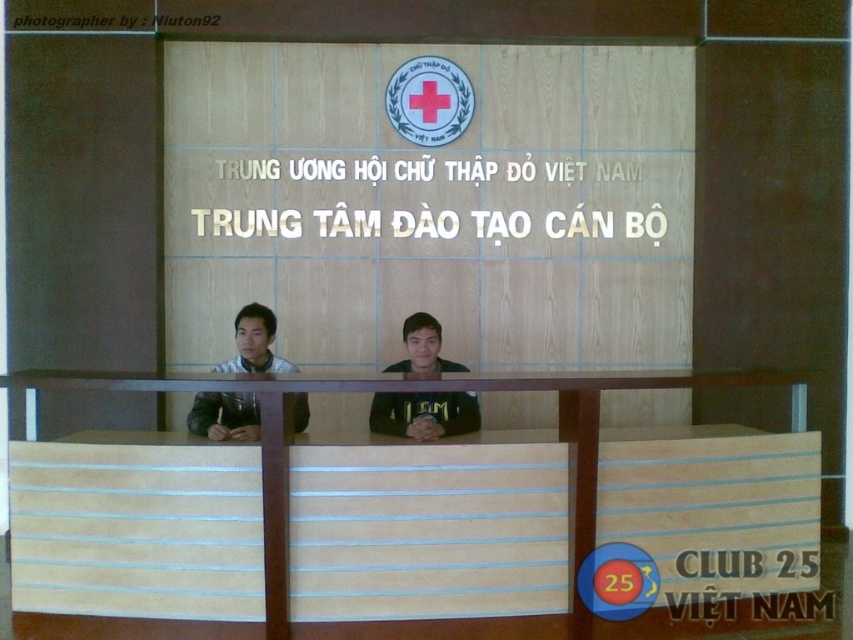
Question: Is black matte shirt at center positioned before matte black jacket at center?

Choices:
 (A) yes
 (B) no

Answer: (B)

Question: Which object is the farthest from the light brown wood at center?

Choices:
 (A) black matte shirt at center
 (B) matte black jacket at center

Answer: (B)

Question: Is light brown wood at center above black matte shirt at center?

Choices:
 (A) no
 (B) yes

Answer: (A)

Question: Among these points, which one is farthest from the camera?

Choices:
 (A) (601, 380)
 (B) (236, 320)

Answer: (B)

Question: Does light brown wood at center appear over matte black jacket at center?

Choices:
 (A) no
 (B) yes

Answer: (A)

Question: Which of the following is the closest to the observer?

Choices:
 (A) (241, 384)
 (B) (233, 436)

Answer: (A)